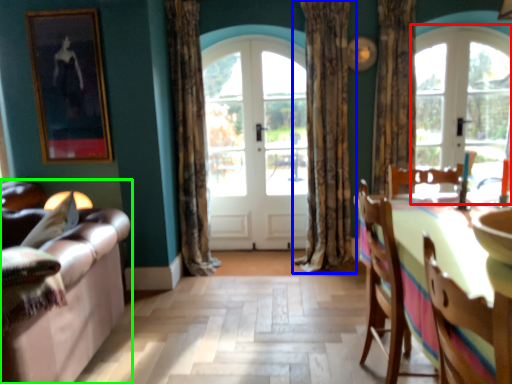
Question: Which object is the closest to the window (highlighted by a red box)? Choose among these: curtain (highlighted by a blue box) or studio couch (highlighted by a green box).

Choices:
 (A) curtain
 (B) studio couch

Answer: (A)